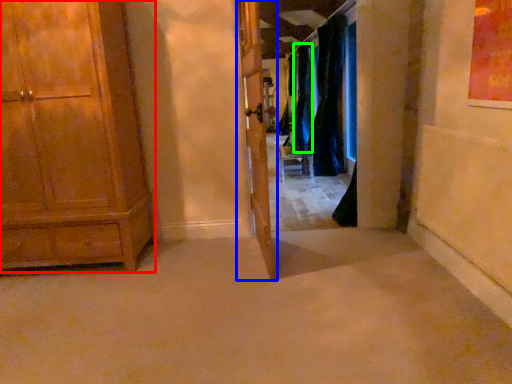
Question: Based on their relative distances, which object is farther from cabinetry (highlighted by a red box)? Choose from door (highlighted by a blue box) and curtain (highlighted by a green box).

Choices:
 (A) door
 (B) curtain

Answer: (B)